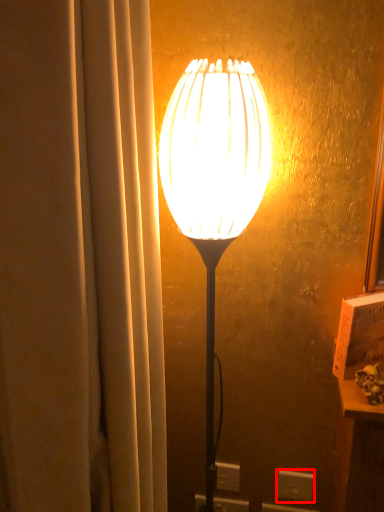
Question: Considering the relative positions of electric outlet (annotated by the red box) and lamp in the image provided, where is electric outlet (annotated by the red box) located with respect to the staircase?

Choices:
 (A) right
 (B) left

Answer: (A)